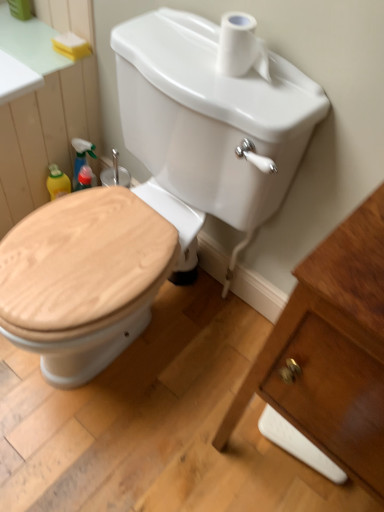
Locate an element on the screen. The width and height of the screenshot is (384, 512). free point below white glossy porcelain at right (from a real-world perspective) is located at coordinates (305, 472).